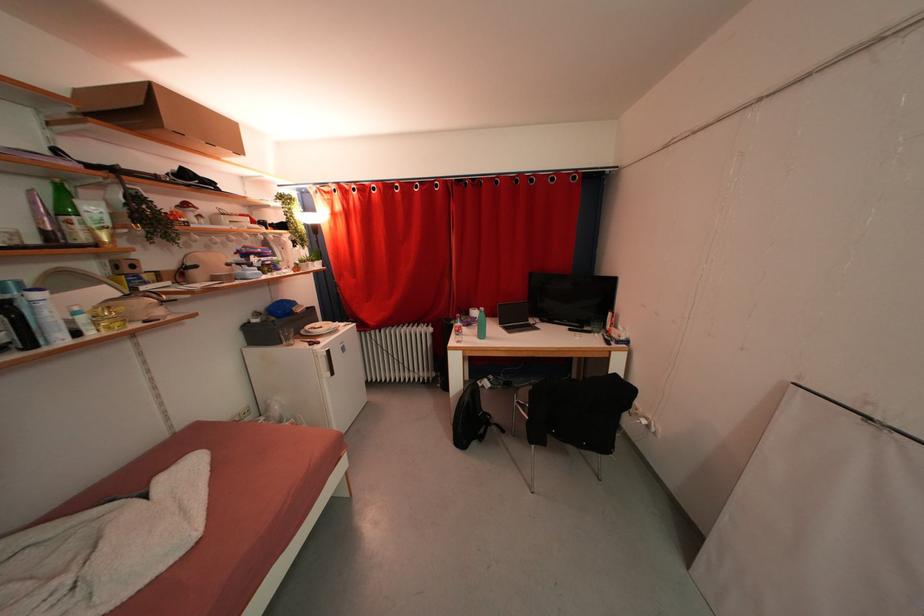
Locate an element on the screen. refrigerator door handle is located at coordinates (323, 362).